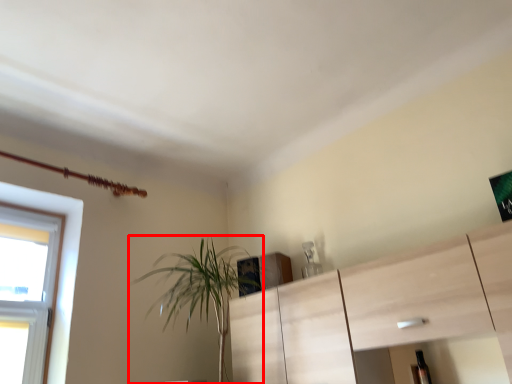
Question: From the image, what is the correct spatial relationship of houseplant (annotated by the red box) in relation to bottle?

Choices:
 (A) right
 (B) left

Answer: (B)